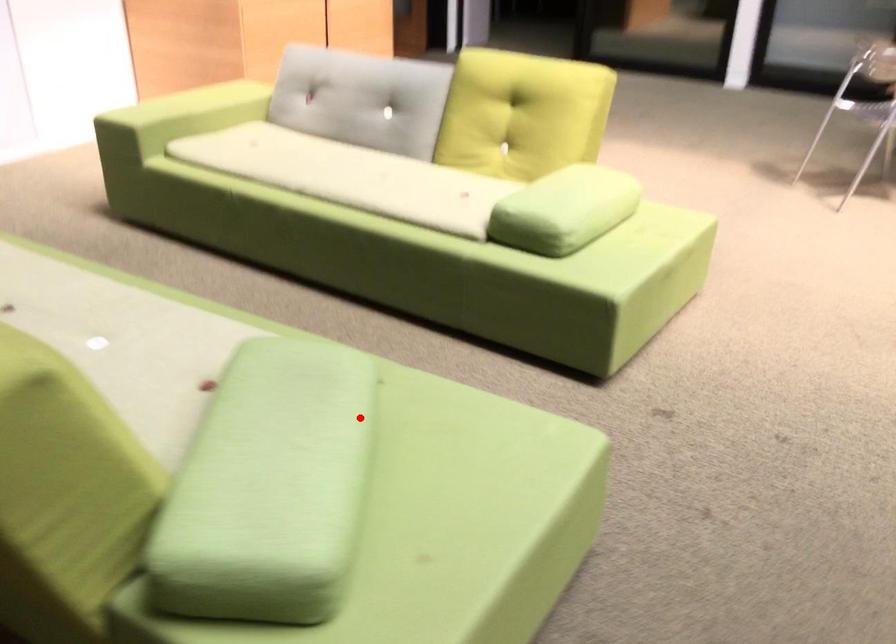
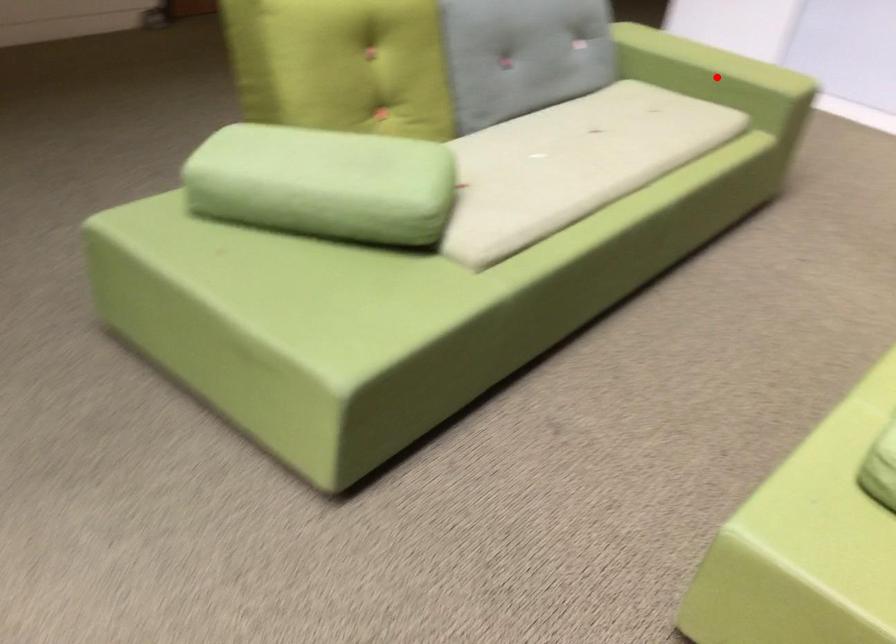
Based on the photo, I am providing you with two images of the same scene from different viewpoints. A red point is marked on the first image and another point is marked on the second image. Is the red point in image1 aligned with the point shown in image2?

No